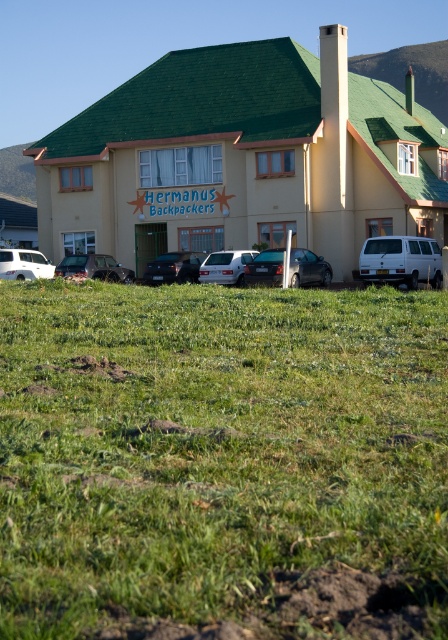
Question: Which point is closer to the camera?

Choices:
 (A) metallic silver sedan at center
 (B) white matte van at center
 (C) white matte van at lower right

Answer: (C)

Question: Can you confirm if metallic silver car at center is positioned to the right of white matte van at center?

Choices:
 (A) no
 (B) yes

Answer: (A)

Question: Is metallic silver sedan at center bigger than white matte van at center?

Choices:
 (A) yes
 (B) no

Answer: (B)

Question: Which object is closer to the camera taking this photo?

Choices:
 (A) metallic silver car at center
 (B) satin black car at center

Answer: (B)

Question: Which point is farther to the camera?

Choices:
 (A) white matte van at center
 (B) white matte van at left
 (C) green grass at lower center

Answer: (B)

Question: Can you confirm if metallic silver car at center is wider than white matte van at left?

Choices:
 (A) no
 (B) yes

Answer: (B)